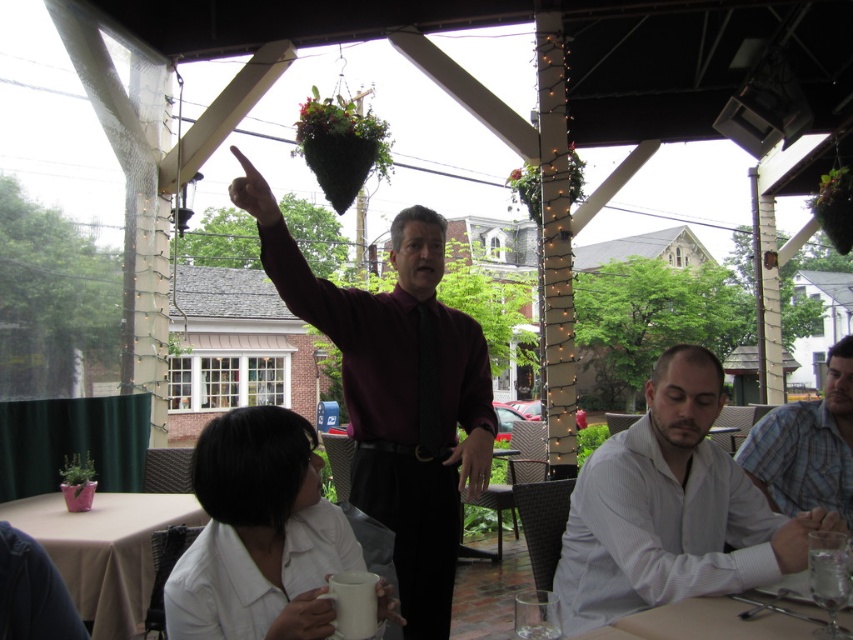
You are sitting at the covered patio and want to wave to the person in the matte burgundy shirt at center and the person in the white textured shirt at lower right. Which direction should you wave to first to reach both starting from the left?

You should first wave to the matte burgundy shirt at center, which is on the left side, then to the white textured shirt at lower right, which is on the right side, since the matte burgundy shirt at center is to the left of white textured shirt at lower right.